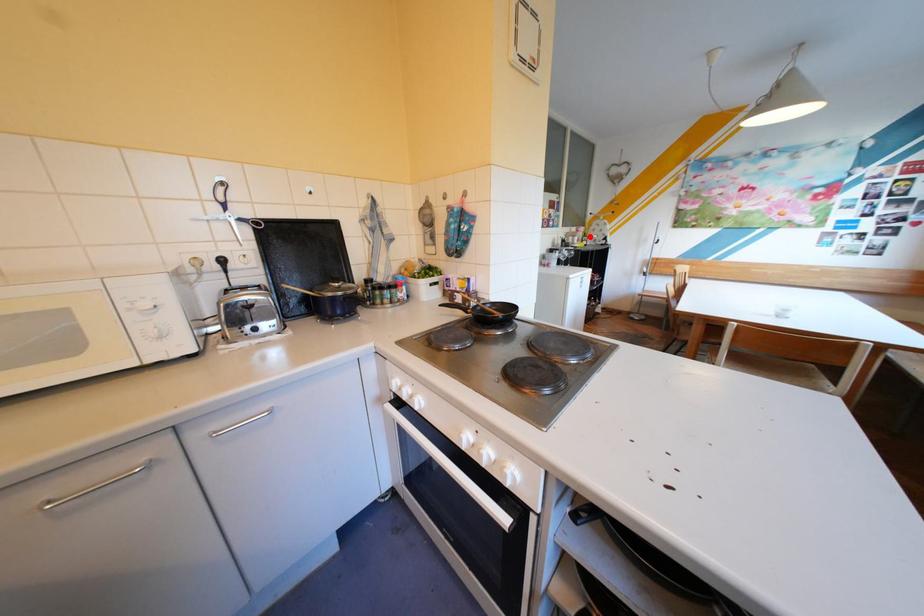
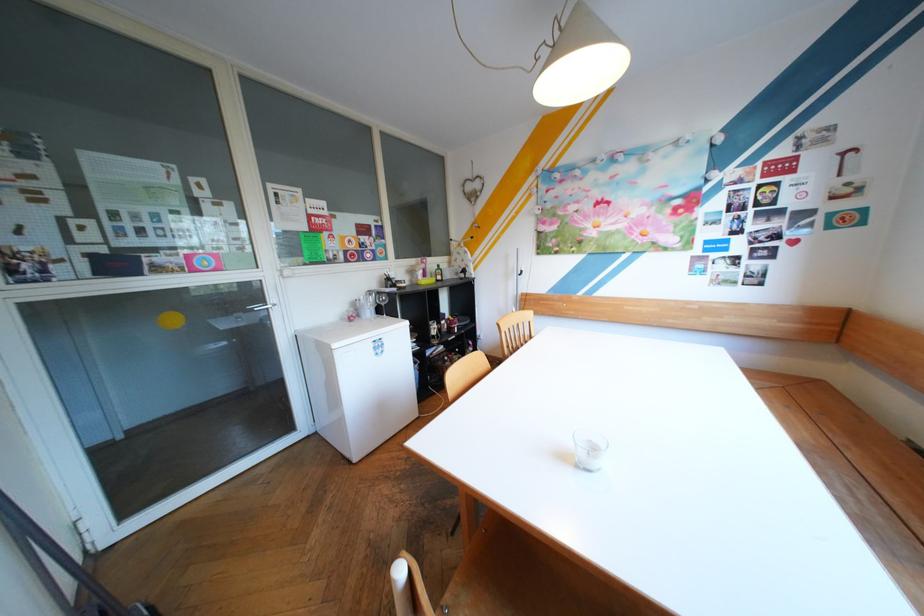
Where in the second image is the point corresponding to the highlighted location from the first image?

(434, 270)